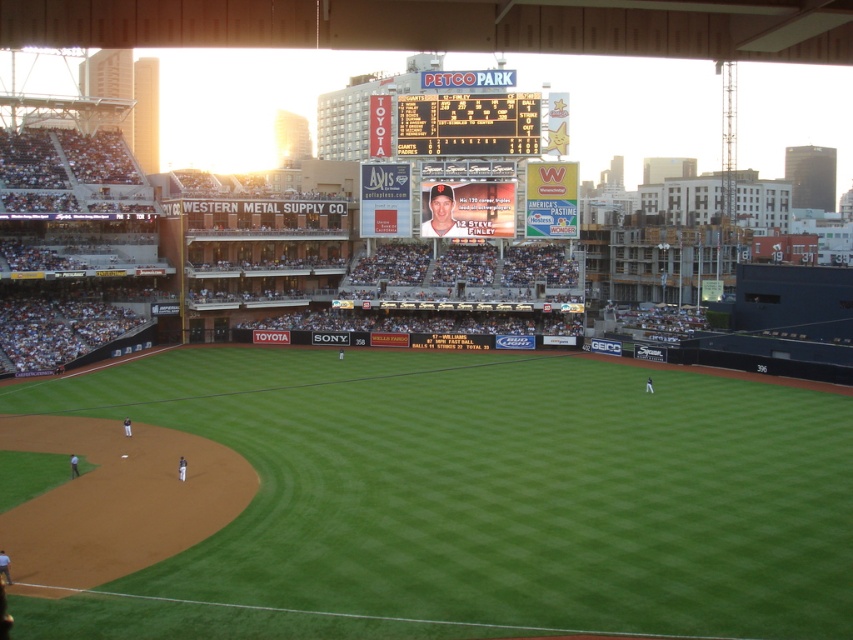
You are a photographer standing at the edge of the baseball field. You want to take a photo that includes both the green artificial turf at center and the matte plastic baseball card at center. Which object should you position to the left side in your camera frame?

The green artificial turf at center should be positioned to the left side in your camera frame because it is located on the left side of the matte plastic baseball card at center.

You are a photographer standing at the edge of the baseball field. You want to take a photo that includes both the green artificial turf at center and the black plastic scoreboard at upper center. Which object will appear larger in your photo?

The black plastic scoreboard at upper center will appear larger in the photo because it is taller than the green artificial turf at center.